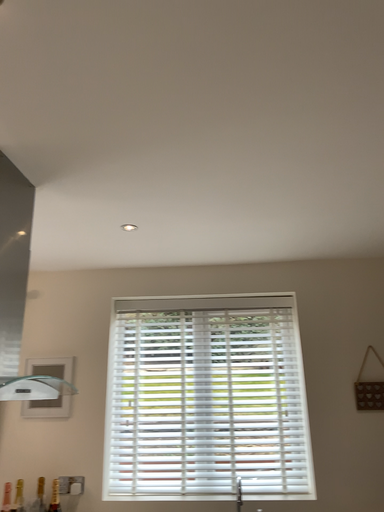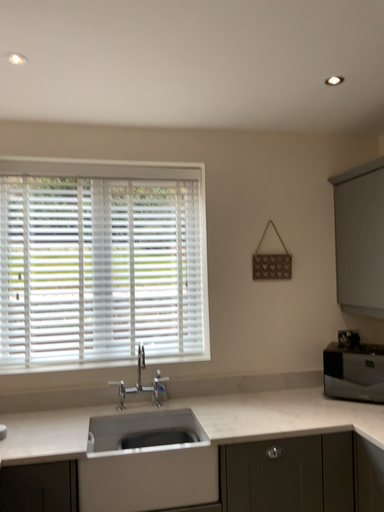
Question: Which way did the camera rotate in the video?

Choices:
 (A) rotated downward
 (B) rotated upward

Answer: (A)